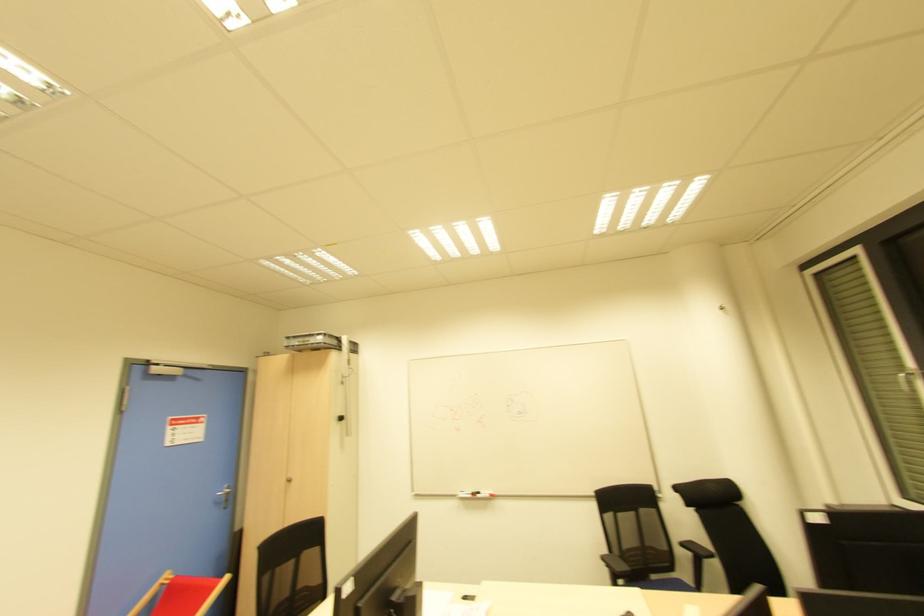
Where would you lift the black whiteboard marker? Please return your answer as a coordinate pair (x, y).

(470, 495)